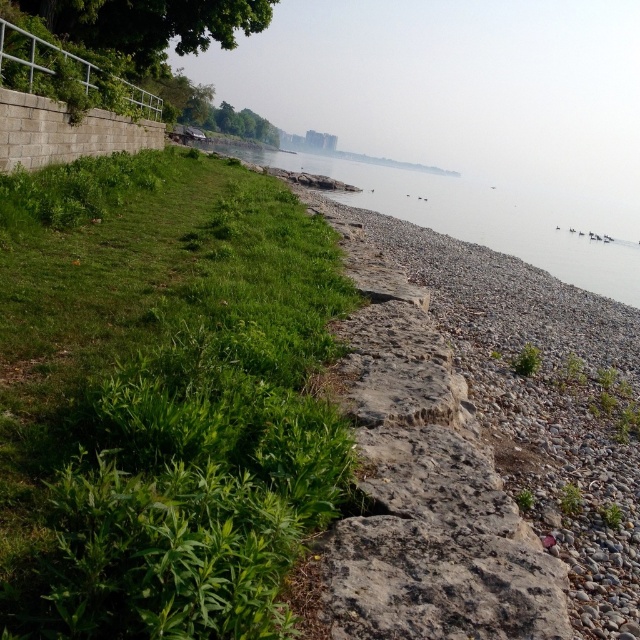
Looking at this image, is gray gravel water at lower right above green leafy tree at upper left?

Yes, gray gravel water at lower right is above green leafy tree at upper left.

Can you confirm if gray gravel water at lower right is thinner than green leafy tree at upper left?

Incorrect, gray gravel water at lower right's width is not less than green leafy tree at upper left's.

Is point (596, 250) farther from viewer compared to point (225, 42)?

Yes, it is behind point (225, 42).

This screenshot has height=640, width=640. In order to click on gray gravel water at lower right in this screenshot , I will do `click(486, 216)`.